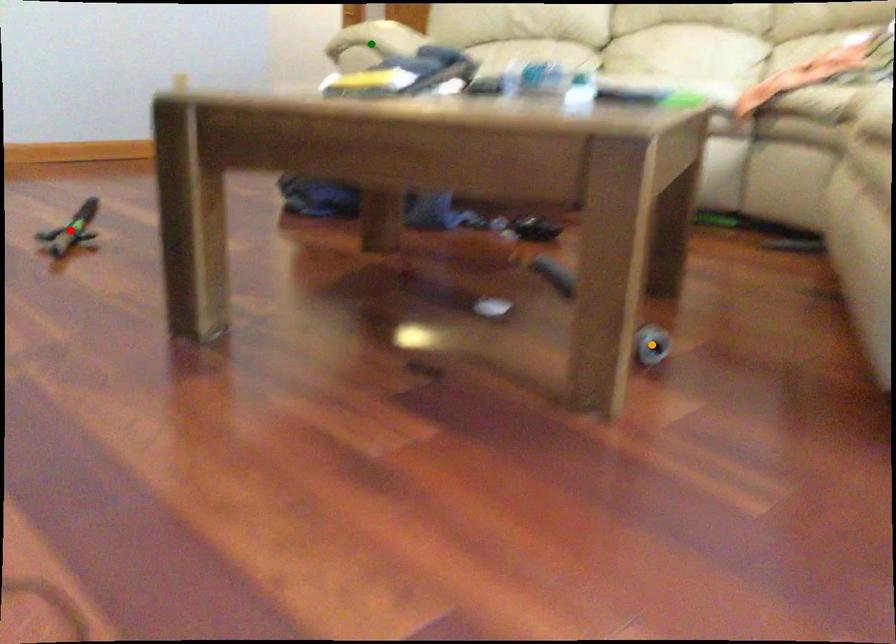
Order these from nearest to farthest:
1. green point
2. orange point
3. red point

green point < red point < orange point